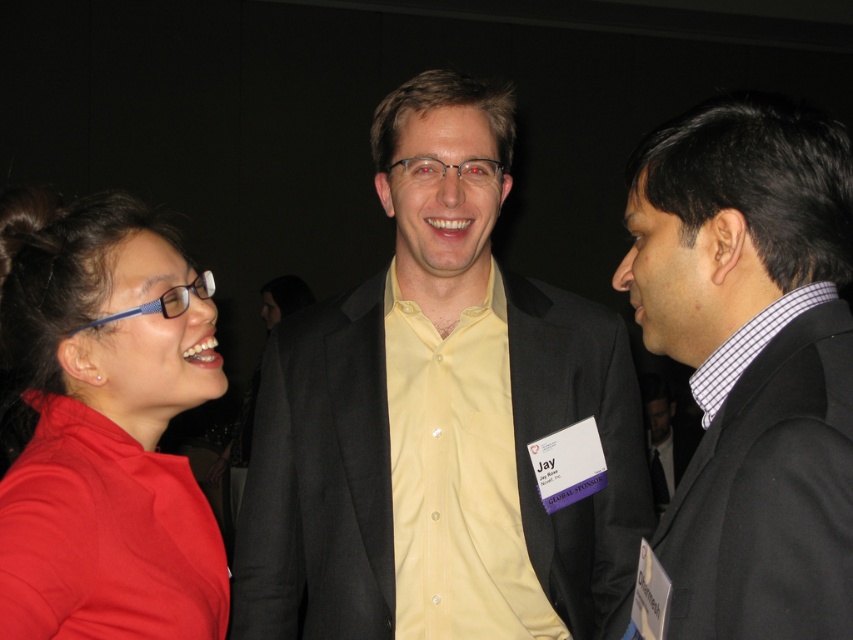
Question: Estimate the real-world distances between objects in this image. Which object is farther from the yellow matte shirt at center?

Choices:
 (A) matte black suit at right
 (B) white checkered shirt at right
 (C) matte red shirt at left

Answer: (B)

Question: Which object appears closest to the camera in this image?

Choices:
 (A) matte red shirt at left
 (B) white checkered shirt at right
 (C) matte black suit at right
 (D) yellow matte shirt at center

Answer: (C)

Question: Can you confirm if matte red shirt at left is bigger than white checkered shirt at right?

Choices:
 (A) no
 (B) yes

Answer: (B)

Question: Which point appears farthest from the camera in this image?

Choices:
 (A) (809, 298)
 (B) (465, 522)
 (C) (165, 544)
 (D) (451, 468)

Answer: (D)

Question: Does matte black suit at right appear on the right side of yellow smooth shirt at center?

Choices:
 (A) yes
 (B) no

Answer: (A)

Question: Is yellow matte shirt at center below matte red shirt at left?

Choices:
 (A) yes
 (B) no

Answer: (B)